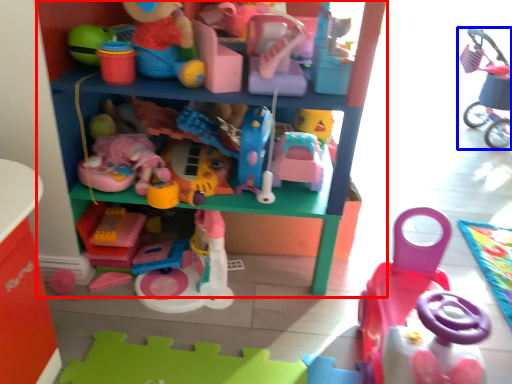
Question: Which object is closer to the camera taking this photo, shelf (highlighted by a red box) or toy (highlighted by a blue box)?

Choices:
 (A) shelf
 (B) toy

Answer: (A)